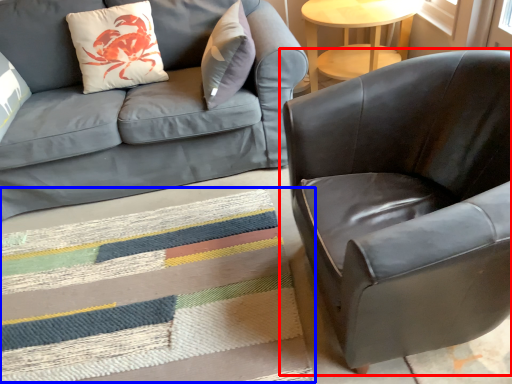
Question: Which object is closer to the camera taking this photo, chair (highlighted by a red box) or mat (highlighted by a blue box)?

Choices:
 (A) chair
 (B) mat

Answer: (A)